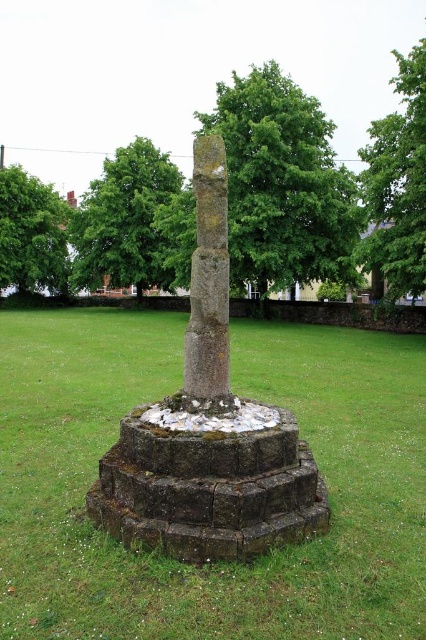
Question: Is green leafy tree at upper right smaller than green leafy tree at upper left?

Choices:
 (A) no
 (B) yes

Answer: (A)

Question: Which of the following is the closest to the observer?

Choices:
 (A) tap(141, 243)
 (B) tap(193, 250)

Answer: (B)

Question: Is green leafy tree at upper center wider than green leafy tree at upper left?

Choices:
 (A) no
 (B) yes

Answer: (B)

Question: Which point is farther from the camera taking this photo?

Choices:
 (A) (376, 196)
 (B) (42, 196)

Answer: (B)

Question: Does brown stone column at center lie behind rusty stone pillar at center?

Choices:
 (A) no
 (B) yes

Answer: (A)

Question: Which point is closer to the camera?

Choices:
 (A) brown stone column at center
 (B) green leafy tree at upper right
 (C) green leafy tree at upper center

Answer: (A)